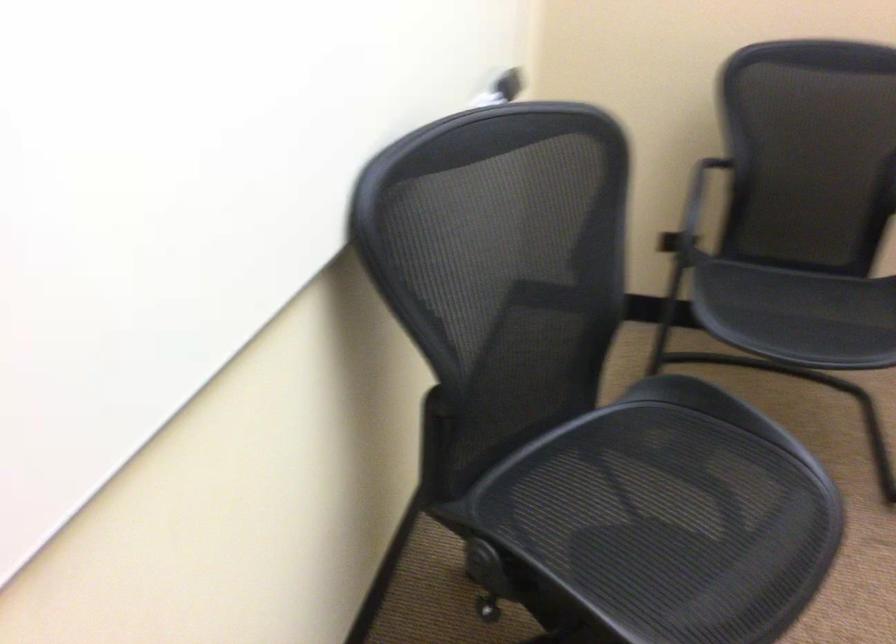
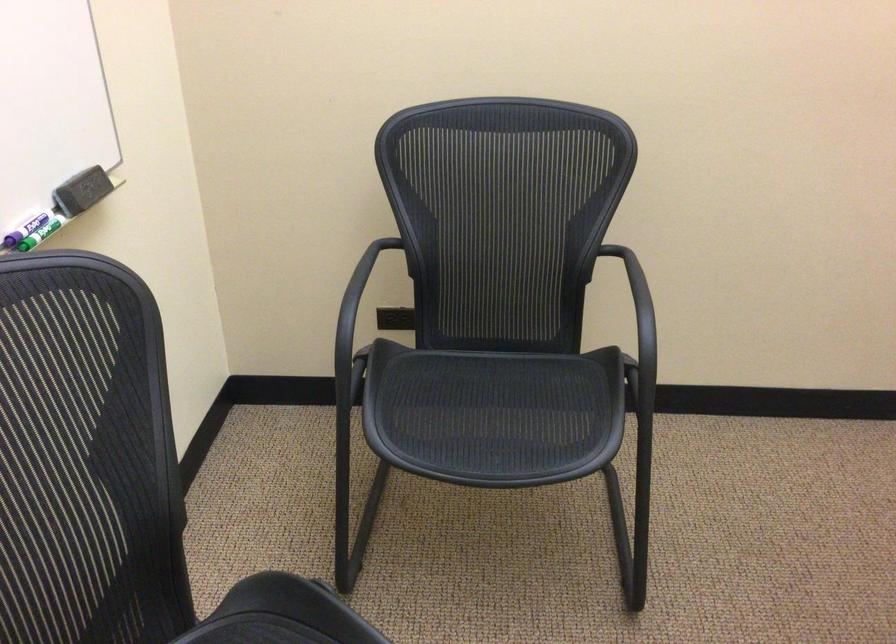
The point at (x=483, y=102) is marked in the first image. Where is the corresponding point in the second image?

(41, 232)